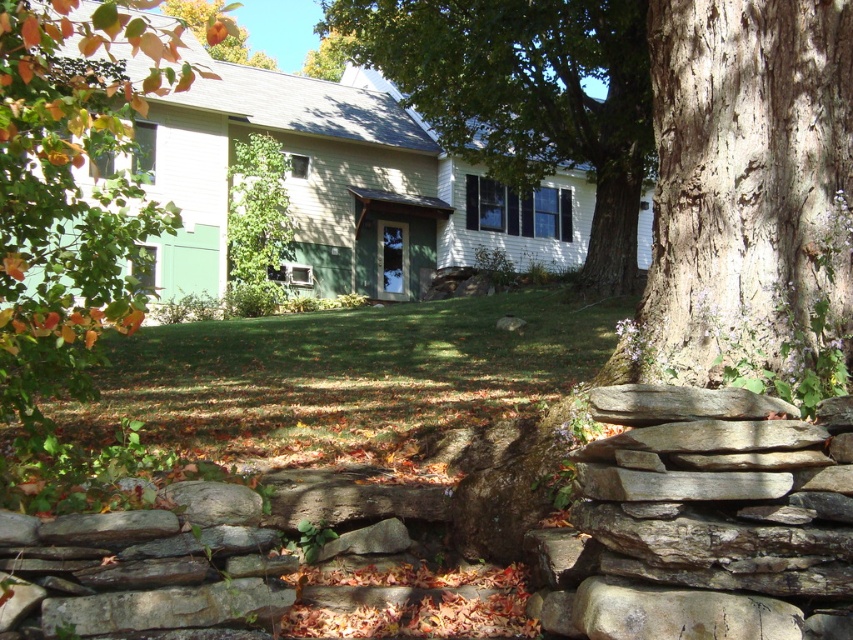
Question: Can you confirm if green leafy tree at center is wider than green leafy tree at upper center?

Choices:
 (A) yes
 (B) no

Answer: (B)

Question: Which point is closer to the camera?

Choices:
 (A) green leafy tree at left
 (B) green textured tree at center

Answer: (A)

Question: Estimate the real-world distances between objects in this image. Which object is closer to the green leafy tree at upper center?

Choices:
 (A) green textured tree at center
 (B) green leafy tree at center
 (C) green leafy tree at left

Answer: (A)

Question: Is green leafy tree at left to the right of green textured tree at center from the viewer's perspective?

Choices:
 (A) yes
 (B) no

Answer: (B)

Question: Which object is positioned closest to the green leafy tree at upper center?

Choices:
 (A) green leafy tree at left
 (B) green textured tree at center

Answer: (B)

Question: Is green leafy tree at left to the right of green textured tree at center from the viewer's perspective?

Choices:
 (A) no
 (B) yes

Answer: (A)